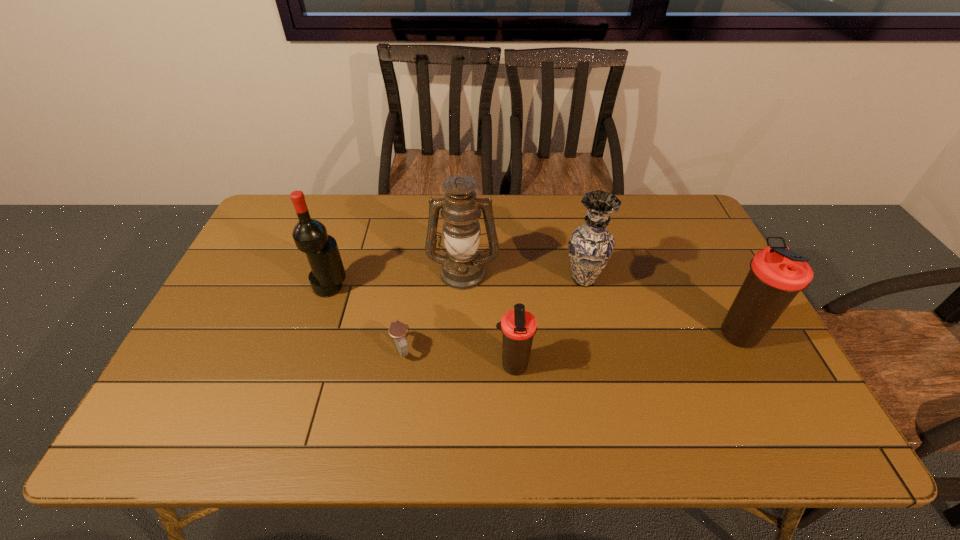
Where is `free spot between the oil lamp and the taller thermos bottle`? free spot between the oil lamp and the taller thermos bottle is located at coordinates (602, 302).

Where is `free point between the oil lamp and the left thermos bottle`? Image resolution: width=960 pixels, height=540 pixels. free point between the oil lamp and the left thermos bottle is located at coordinates (488, 319).

Locate an element on the screen. the closest object to the vase is located at coordinates [x=463, y=268].

Locate an element on the screen. object that can be found as the closest to the taller thermos bottle is located at coordinates (590, 246).